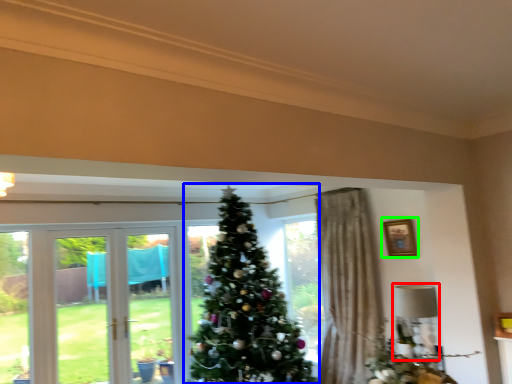
Question: Based on their relative distances, which object is nearer to lamp (highlighted by a red box)? Choose from christmas tree (highlighted by a blue box) and picture frame (highlighted by a green box).

Choices:
 (A) christmas tree
 (B) picture frame

Answer: (B)